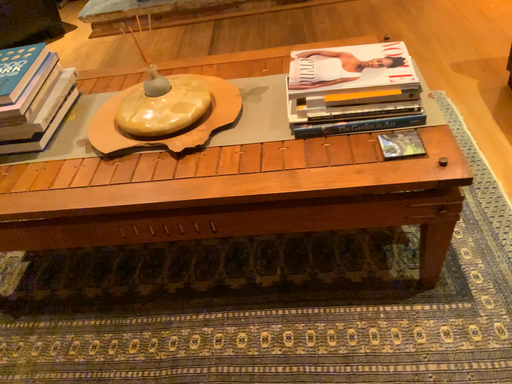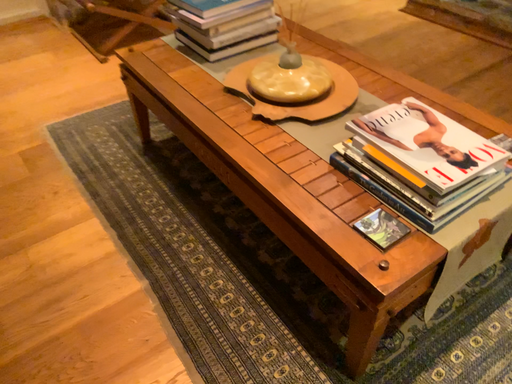
Question: Which way did the camera rotate in the video?

Choices:
 (A) rotated left
 (B) rotated right

Answer: (A)